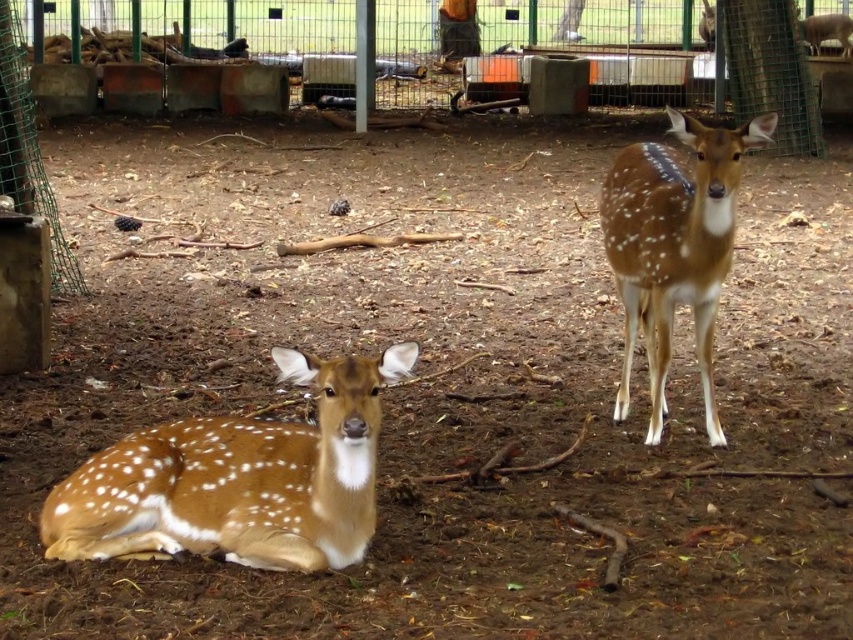
You are a zookeeper observing two deer in their enclosure. You notice the brown speckled fur at lower left and the brown spotted fur at right. Which deer is positioned lower in the image?

The brown speckled fur at lower left is located below the brown spotted fur at right, so the deer with brown speckled fur at lower left is positioned lower in the image.

You are a zookeeper trying to locate the deer with brown speckled fur at lower left in the enclosure. According to the coordinates provided, where exactly would you find this deer?

The brown speckled fur at lower left is located at coordinates point (238, 480).